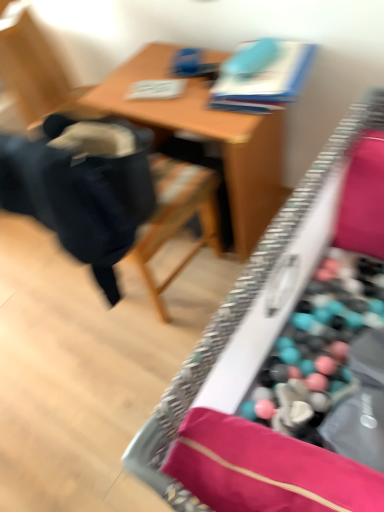
At what (x,y) coordinates should I click in order to perform the action: click on vacant space in black fabric chair at left (from a real-world perspective). Please return your answer as a coordinate pair (x, y). Image resolution: width=384 pixels, height=512 pixels. Looking at the image, I should click on (162, 279).